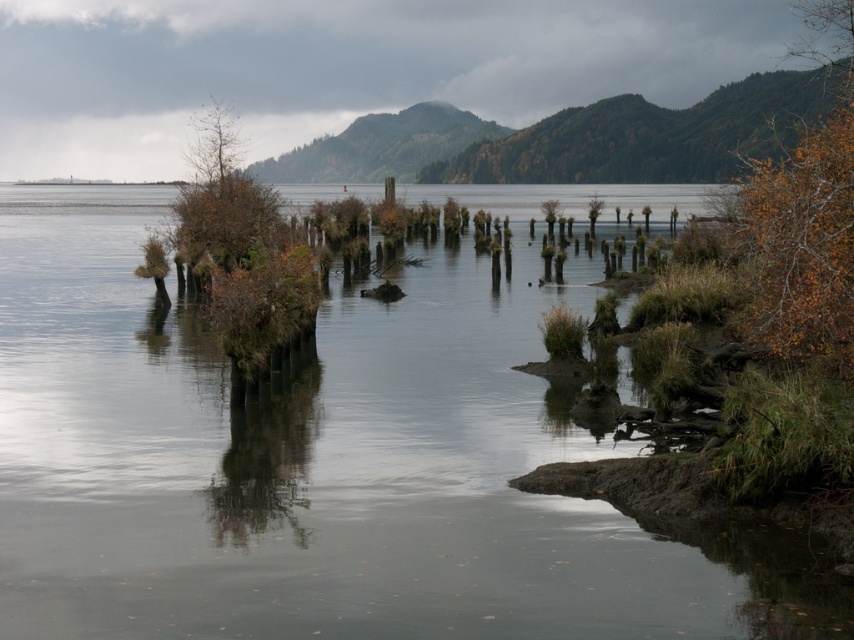
You are standing at the edge of the lake and want to locate the clear water at center. Based on the coordinates provided, in which direction should you move relative to your current position?

The clear water at center is located at coordinates point (329, 458). Since the coordinate system is not specified, it is recommended to move towards the center of the lake where the clear water is most likely to be found.

You are standing at the lakeside and want to reach the brown matte tree at upper left. Given that the tree is 22.01 meters away, can you estimate how many average paces you would need to take to reach it?

The brown matte tree at upper left is 22.01 meters away. An average pace is about 0.76 meters, so dividing 22.01 by 0.76 gives approximately 29 paces. Therefore, you would need to take around 29 average paces to reach the brown matte tree at upper left.

You are standing on the lakeside and see the clear water at center and the brown rough tree at center. Which object is positioned more to the right?

The brown rough tree at center is positioned more to the right than the clear water at center.